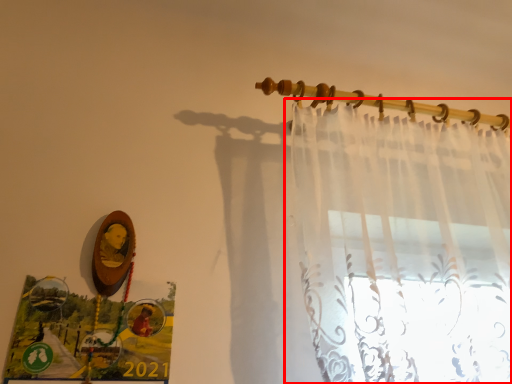
Question: Where is curtain (annotated by the red box) located in relation to clothesline in the image?

Choices:
 (A) right
 (B) left

Answer: (A)